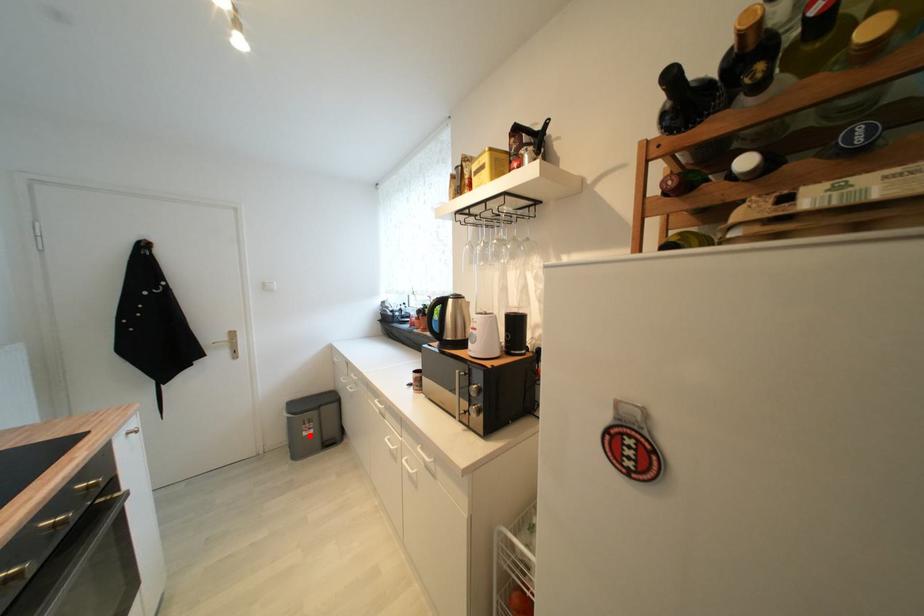
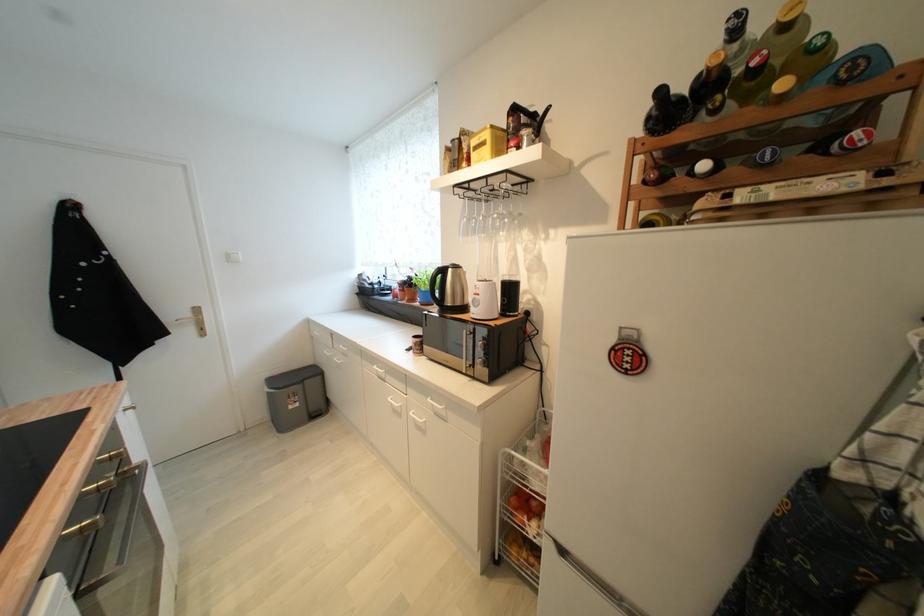
The point at the highlighted location is marked in the first image. Where is the corresponding point in the second image?

(296, 408)